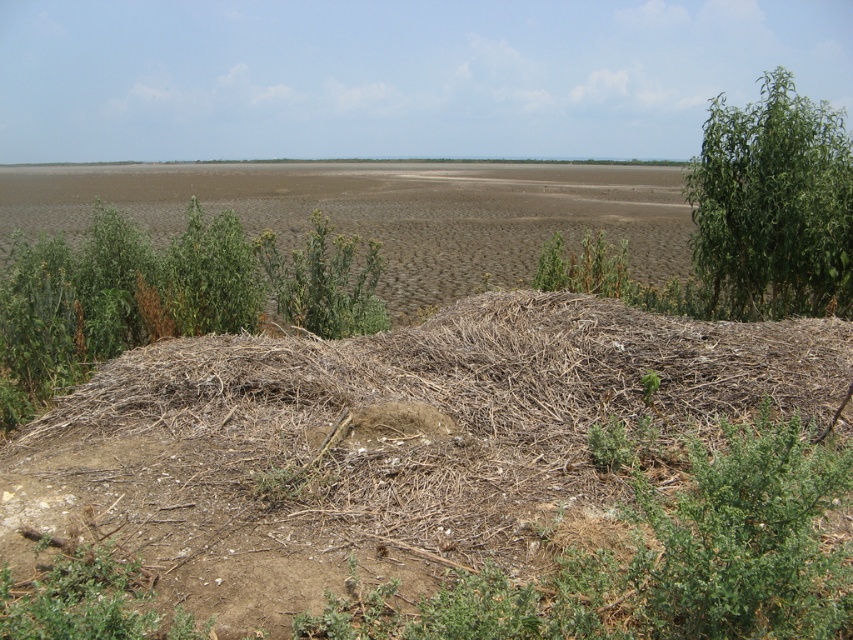
You are a hiker navigating this barren landscape. You see the green leafy plant at left and the green leafy tree at upper right. Which one is positioned more towards the east if the image is oriented with north at the top?

The green leafy tree at upper right is positioned more towards the east because it is located to the upper right of the green leafy plant at left, and since the image is oriented with north at the top, east would be to the right side.

You are standing in the barren landscape and want to walk from the green leafy plant at left to the green leafy tree at upper right. Which direction should you move to get closer to the tree?

To move closer to the green leafy tree at upper right, you should move away from the green leafy plant at left since the tree is further away in the distance compared to the plant.

You are a hiker trying to navigate this barren landscape. You need to find the tallest green vegetation to determine where water might be. Which should you head towards, the green leafy plant at left or the green leafy tree at upper right?

The green leafy tree at upper right is taller than the green leafy plant at left, so you should head towards the green leafy tree at upper right as it might indicate a water source.